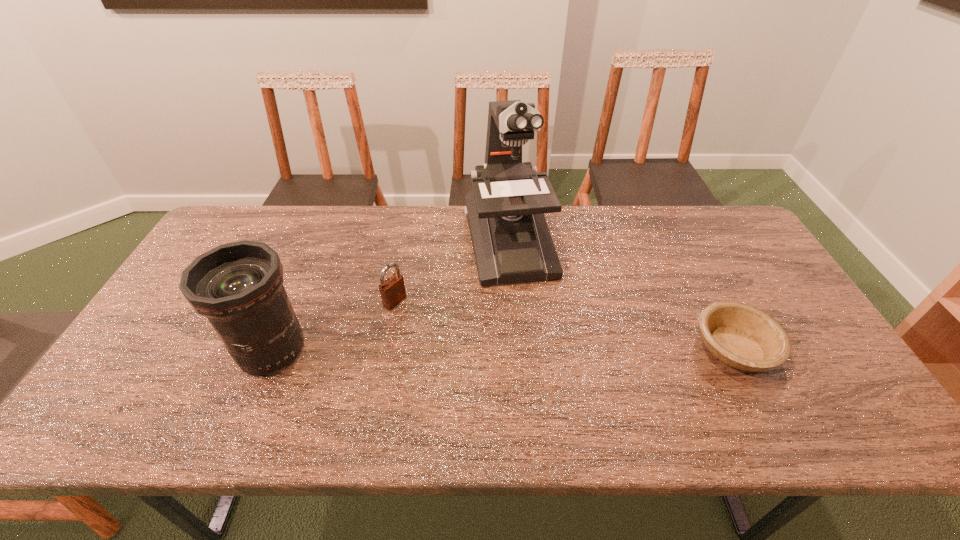
Locate an element on the screen. vacant space on the desktop that is between the telephoto lens and the rightmost object and is positioned through the eyepieces of the microscope is located at coordinates (540, 349).

Where is `free spot on the desktop that is between the second tallest object and the shortest object and is positioned on the front-facing side of the third object from right to left`? free spot on the desktop that is between the second tallest object and the shortest object and is positioned on the front-facing side of the third object from right to left is located at coordinates (471, 349).